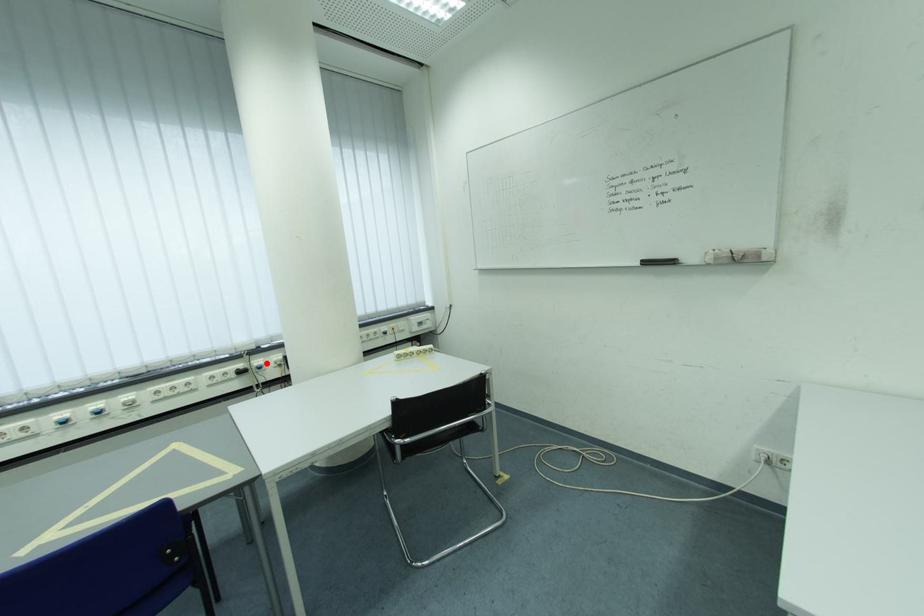
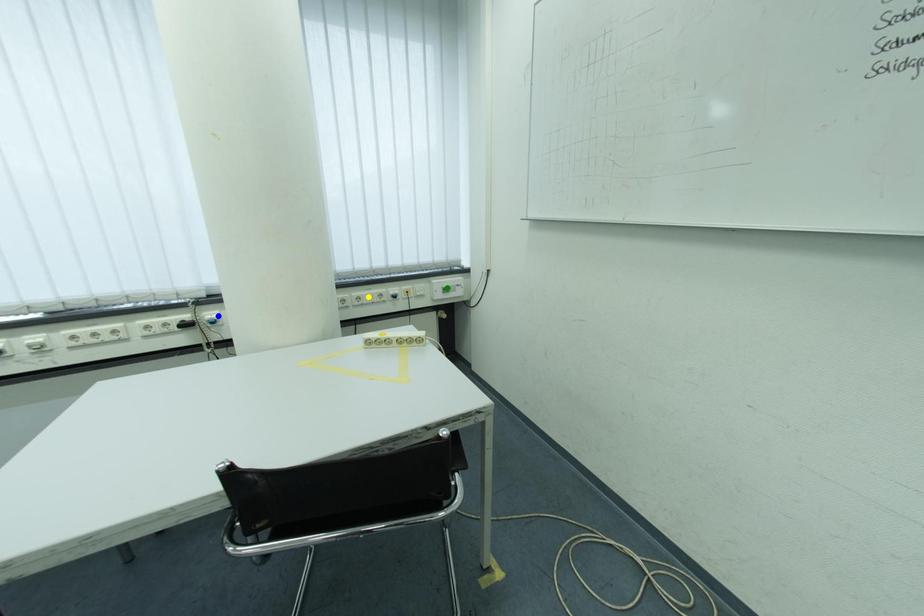
Question: I am providing you with two images of the same scene from different viewpoints. A red point is marked on the first image. You are given multiple points on the second image. Which mark in image 2 goes with the point in image 1?

Choices:
 (A) yellow point
 (B) green point
 (C) blue point

Answer: (C)